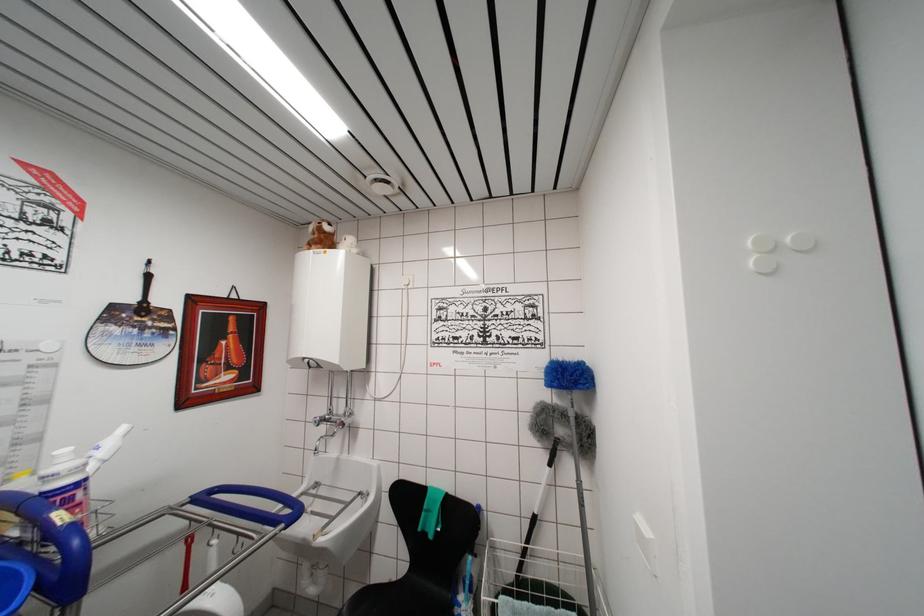
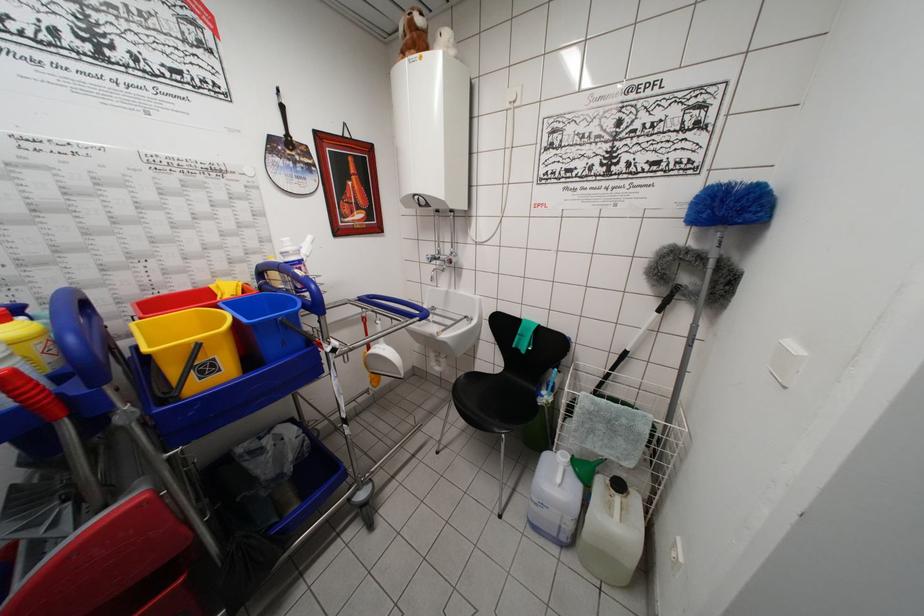
Where in the second image is the point corresponding to (319,426) from the first image?

(432, 262)